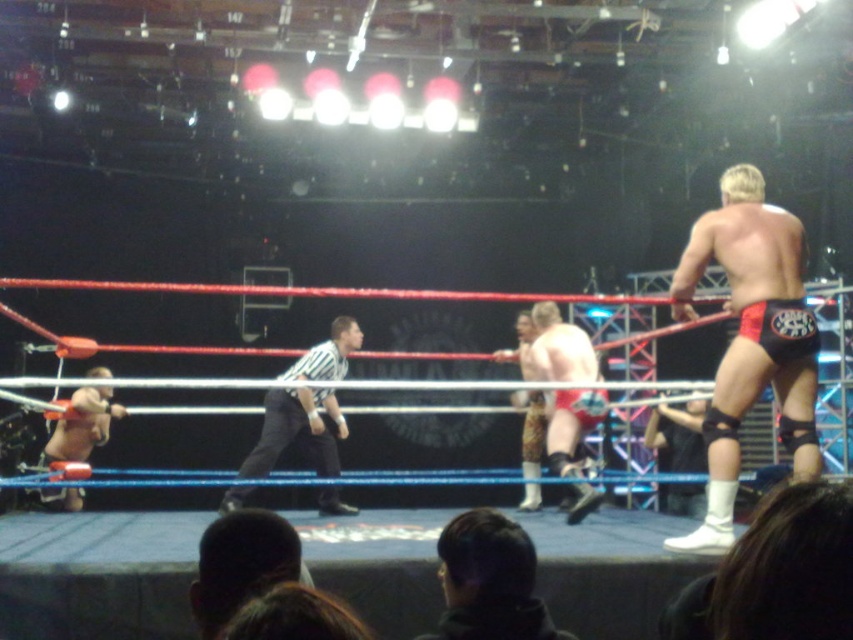
You are a photographer standing outside the wrestling ring. You want to take a photo of both the dark hair at lower center and the red leather boots at center. Based on their positions, which object should you focus on first to ensure both are in the frame?

The dark hair at lower center is positioned on the left side of the red leather boots at center. Therefore, you should focus on the red leather boots at center first, as they are centrally located and will help frame both objects effectively.

You are a referee in the wrestling match and need to ensure the wrestlers are following the rules. From your vantage point, which object is positioned higher between the dark hair at lower center and the red leather boots at center?

The dark hair at lower center is located above the red leather boots at center, so the dark hair at lower center is positioned higher.